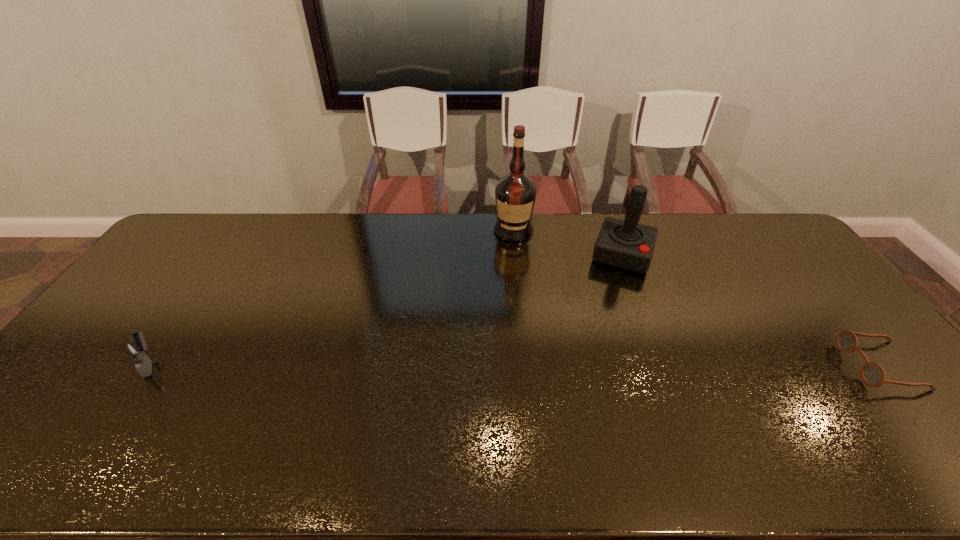
Where is `free space that satisfies the following two spatial constraints: 1. on the front side of the third shortest object; 2. on the front-facing side of the spectacles`? The height and width of the screenshot is (540, 960). free space that satisfies the following two spatial constraints: 1. on the front side of the third shortest object; 2. on the front-facing side of the spectacles is located at coordinates (665, 366).

You are a GUI agent. You are given a task and a screenshot of the screen. Output one action in this format:
    pyautogui.click(x=<x>, y=<y>)
    Task: Click on the free location that satisfies the following two spatial constraints: 1. on the front side of the leftmost object; 2. on the front-facing side of the rightmost object
    
    Given the screenshot: What is the action you would take?
    148,366

The image size is (960, 540). In order to click on free space in the image that satisfies the following two spatial constraints: 1. on the front side of the joystick; 2. on the left side of the liquor in this screenshot , I will do `click(516, 254)`.